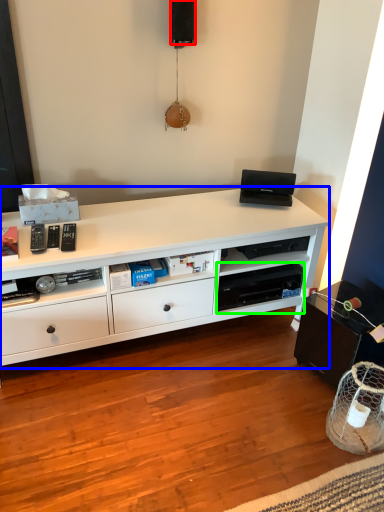
Question: Considering the real-world distances, which object is closest to speaker (highlighted by a red box)? desk (highlighted by a blue box) or shelf (highlighted by a green box).

Choices:
 (A) desk
 (B) shelf

Answer: (A)